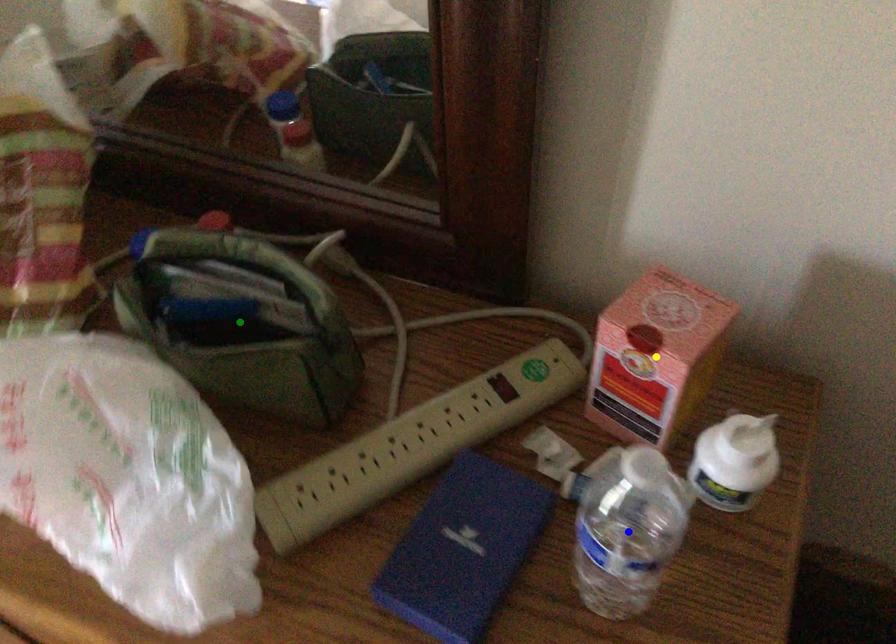
Order these from nearest to farthest:
yellow point, blue point, green point

blue point < yellow point < green point